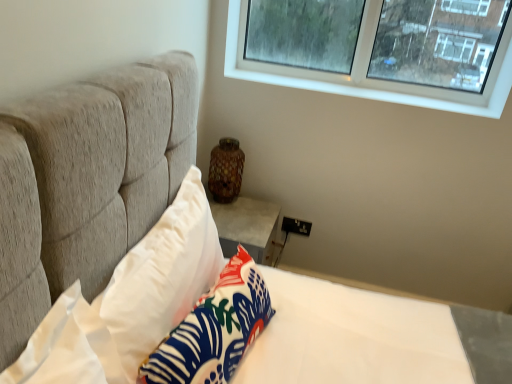
Question: From a real-world perspective, is white smooth stone at upper right on brown speckled ceramic vase at center?

Choices:
 (A) no
 (B) yes

Answer: (B)

Question: Could brown speckled ceramic vase at center be considered to be inside white smooth stone at upper right?

Choices:
 (A) no
 (B) yes

Answer: (A)

Question: Is white smooth stone at upper right located outside brown speckled ceramic vase at center?

Choices:
 (A) yes
 (B) no

Answer: (A)

Question: Considering the relative sizes of white smooth stone at upper right and brown speckled ceramic vase at center in the image provided, is white smooth stone at upper right bigger than brown speckled ceramic vase at center?

Choices:
 (A) no
 (B) yes

Answer: (A)

Question: Is white smooth stone at upper right far away from brown speckled ceramic vase at center?

Choices:
 (A) yes
 (B) no

Answer: (B)

Question: Considering the positions of point (146, 291) and point (196, 337), is point (146, 291) closer or farther from the camera than point (196, 337)?

Choices:
 (A) closer
 (B) farther

Answer: (B)

Question: From a real-world perspective, is white soft pillow at upper left, positioned as the 2th pillow in right-to-left order, positioned above or below white fabric pillow at lower center, the 2th pillow when ordered from left to right?

Choices:
 (A) below
 (B) above

Answer: (B)

Question: Relative to white fabric pillow at lower center, the first pillow from the right, is white soft pillow at upper left, positioned as the 2th pillow in right-to-left order, in front or behind?

Choices:
 (A) behind
 (B) front

Answer: (B)

Question: In terms of height, does white soft pillow at upper left, positioned as the 2th pillow in right-to-left order, look taller or shorter compared to white fabric pillow at lower center, the first pillow from the right?

Choices:
 (A) short
 (B) tall

Answer: (B)

Question: Is white fabric pillow at lower center, the 2th pillow when ordered from left to right, wider or thinner than white smooth stone at upper right?

Choices:
 (A) thin
 (B) wide

Answer: (A)

Question: Relative to white smooth stone at upper right, is white fabric pillow at lower center, the first pillow from the right, in front or behind?

Choices:
 (A) behind
 (B) front

Answer: (B)

Question: Considering the positions of point (231, 274) and point (458, 110), is point (231, 274) closer or farther from the camera than point (458, 110)?

Choices:
 (A) closer
 (B) farther

Answer: (A)

Question: Considering the positions of white fabric pillow at lower center, the 2th pillow when ordered from left to right, and white smooth stone at upper right in the image, is white fabric pillow at lower center, the 2th pillow when ordered from left to right, taller or shorter than white smooth stone at upper right?

Choices:
 (A) tall
 (B) short

Answer: (A)

Question: Considering the positions of white smooth stone at upper right and white fabric pillow at lower center, the 2th pillow when ordered from left to right, in the image, is white smooth stone at upper right bigger or smaller than white fabric pillow at lower center, the 2th pillow when ordered from left to right,?

Choices:
 (A) big
 (B) small

Answer: (B)

Question: Considering the positions of point (321, 87) and point (238, 362), is point (321, 87) closer or farther from the camera than point (238, 362)?

Choices:
 (A) farther
 (B) closer

Answer: (A)